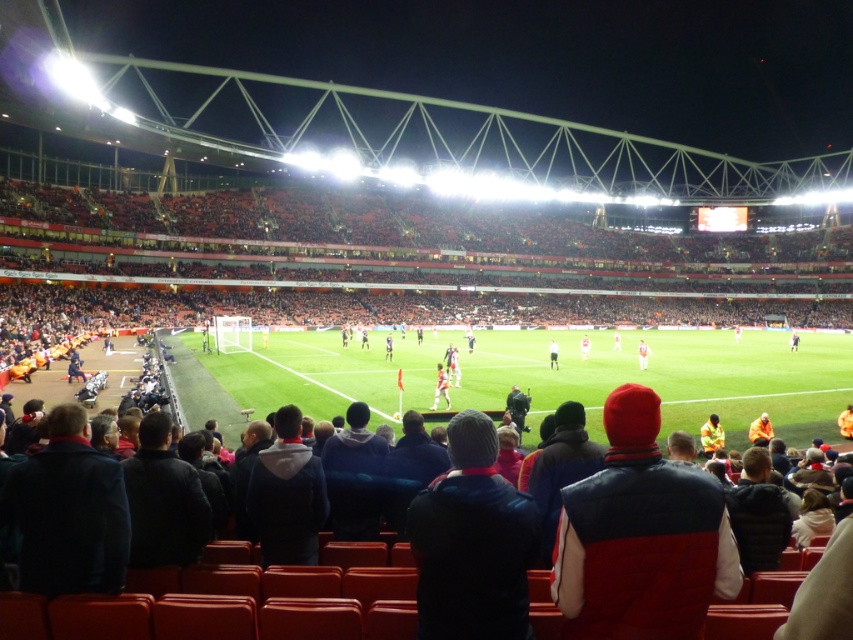
Is white jersey at center behind white fabric shirt at center?

No, white jersey at center is in front of white fabric shirt at center.

Identify the location of white jersey at center. This screenshot has width=853, height=640. (440, 387).

Who is more distant from viewer, (x=440, y=388) or (x=386, y=358)?

Point (x=386, y=358)

Where is `white jersey at center`? white jersey at center is located at coordinates (440, 387).

Locate an element on the screen. white jersey at center is located at coordinates (440, 387).

Who is more distant from viewer, (376, 353) or (437, 374)?

The point (376, 353) is behind.

Is point (476, 406) behind point (444, 397)?

No, it is in front of (444, 397).

Locate an element on the screen. green grass football field at center is located at coordinates (556, 376).